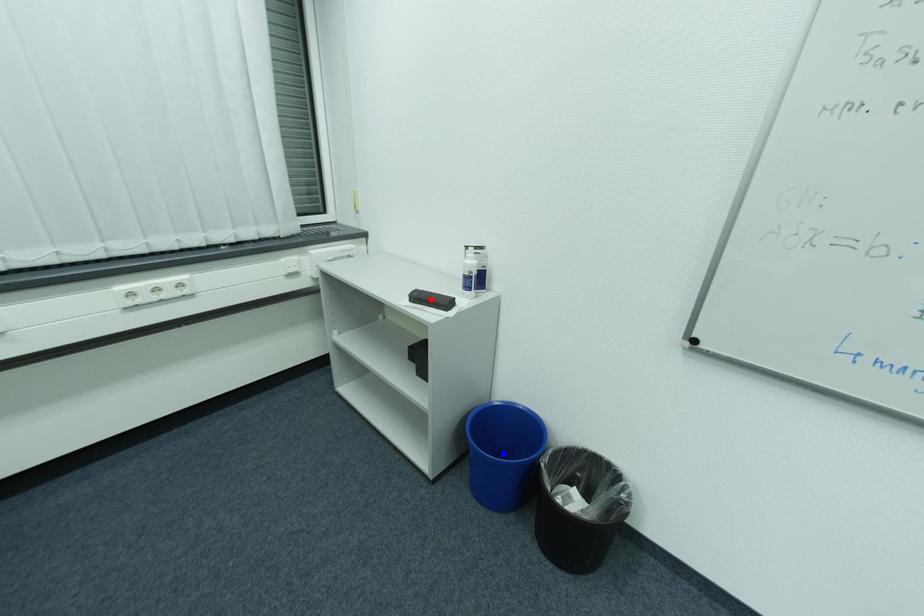
Question: In the image, two points are highlighted. Which point is nearer to the camera? Reply with the corresponding letter.

Choices:
 (A) blue point
 (B) red point

Answer: (B)